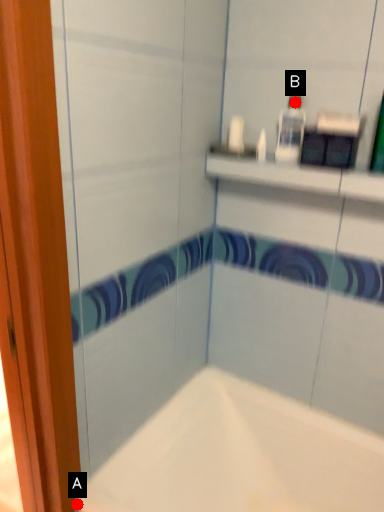
Question: Two points are circled on the image, labeled by A and B beside each circle. Which point is closer to the camera?

Choices:
 (A) A is closer
 (B) B is closer

Answer: (A)